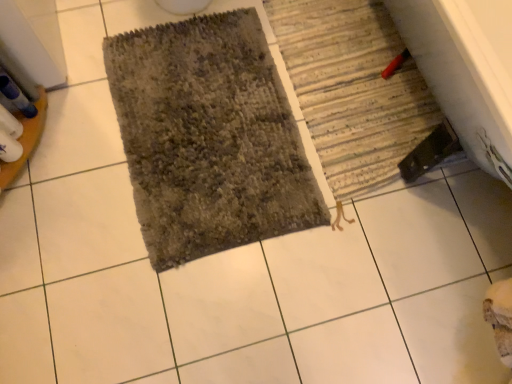
This screenshot has width=512, height=384. Identify the location of blank area beneath textured gray bath mat at center, the 1th bath mat viewed from the left (from a real-world perspective). click(209, 126).